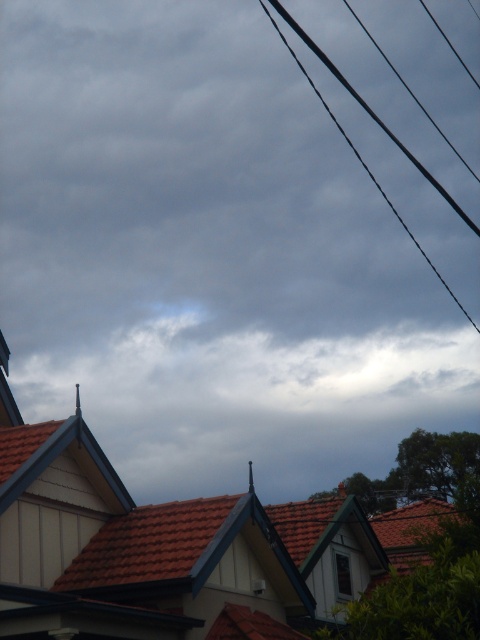
What do you see at coordinates (159, 548) in the screenshot?
I see `brown tile roof at center` at bounding box center [159, 548].

Can you confirm if brown tile roof at center is wider than black wire at upper right?

In fact, brown tile roof at center might be narrower than black wire at upper right.

Locate an element on the screen. This screenshot has height=640, width=480. brown tile roof at center is located at coordinates (x=159, y=548).